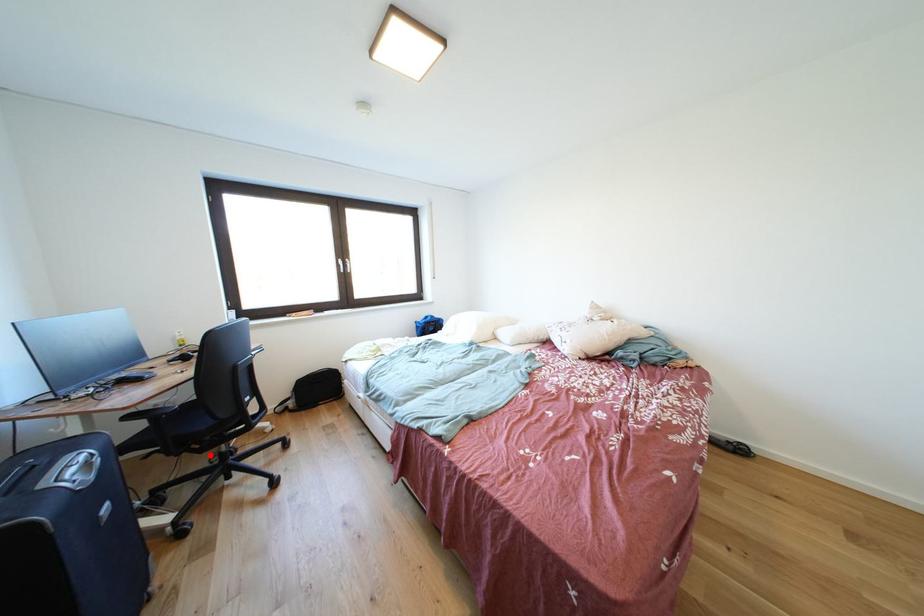
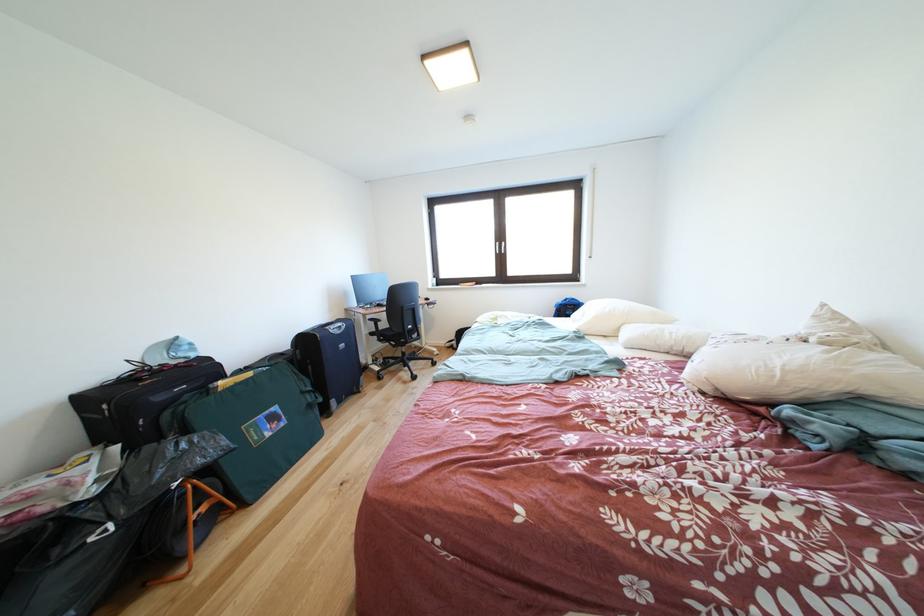
Question: I am providing you with two images of the same scene from different viewpoints. A red point is shown in image1. For the corresponding object point in image2, is it positioned nearer or farther from the camera?

Choices:
 (A) Nearer
 (B) Farther

Answer: (B)